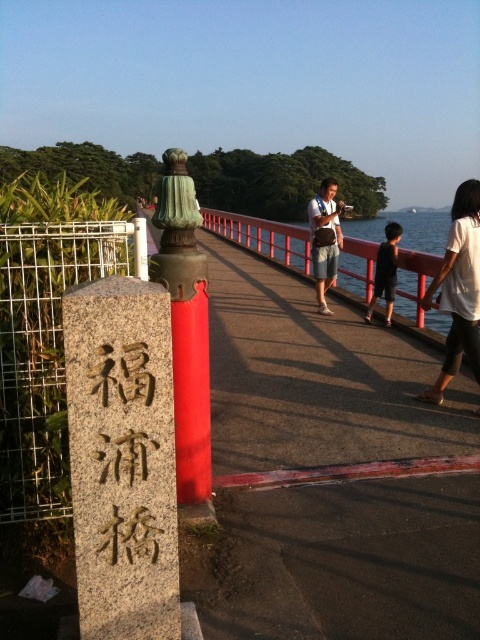
You are standing at the center of the bridge and want to locate the granite stone pillar at left. According to the coordinates provided, which direction should you face to see it?

The granite stone pillar at left is located at coordinates point (121,458). Since the pillar is at the left side of the scene, you should face towards the left direction to see it.

You are standing on the bridge and notice two points marked on the image. The first point is at coordinates point (319, 282) and the second is at point (385, 236). If you want to walk towards the point that is farther away from you, which coordinate should you head towards?

Point (319, 282) is behind point (385, 236), so you should head towards point (319, 282) to walk towards the one that is farther away.